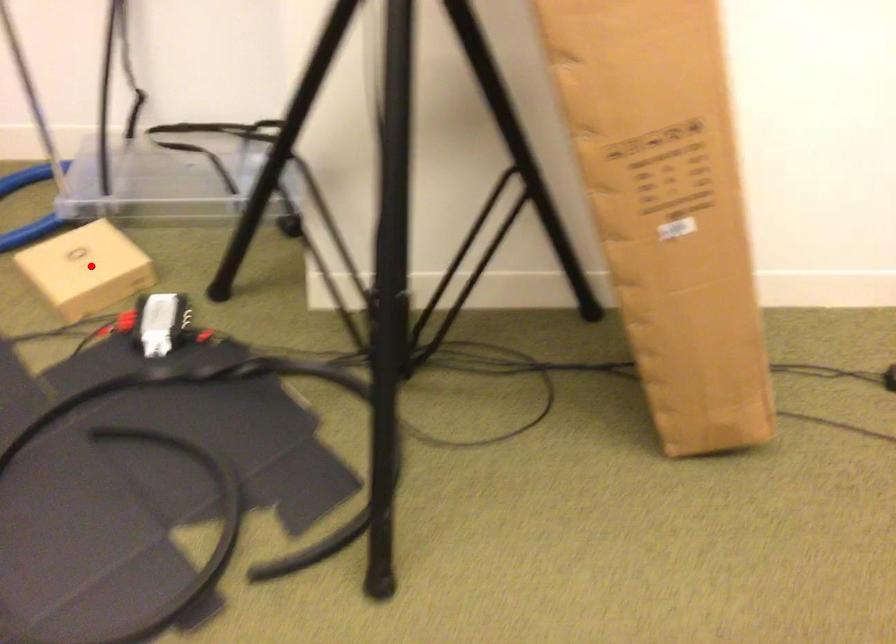
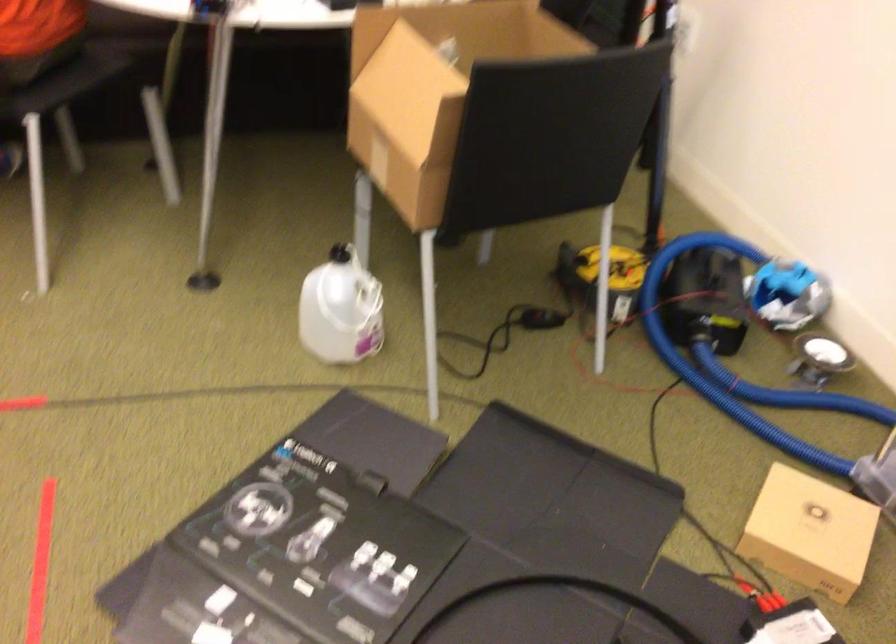
Question: I am providing you with two images of the same scene from different viewpoints. Image1 has a red point marked. In image2, the corresponding 3D location appears at what relative position? Reply with the corresponding letter.

Choices:
 (A) Closer
 (B) Farther

Answer: (A)